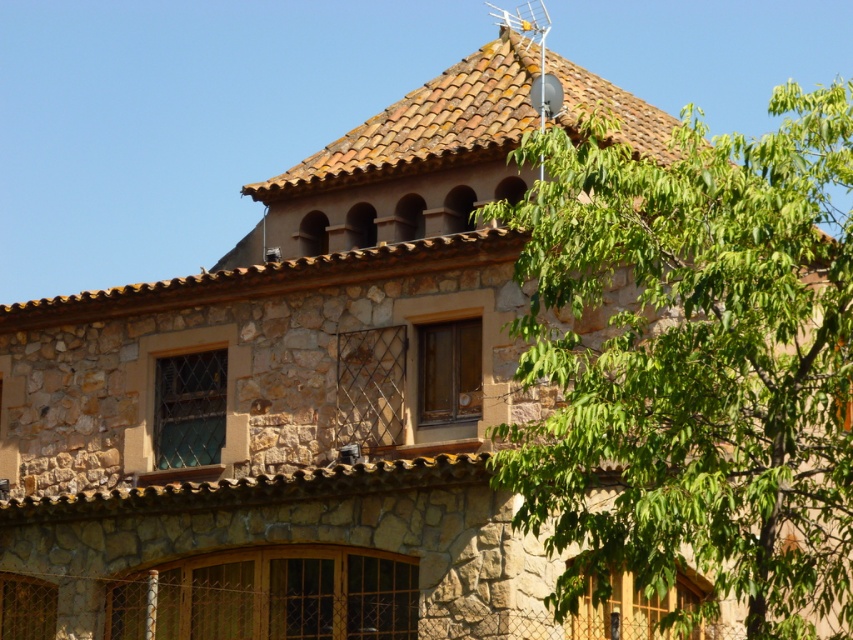
You are an architect assessing the structural integrity of the house. Given the presence of the green leafy tree at upper right and the brown clay tiles at upper center, which object might pose a greater risk to the roof due to its size and proximity?

The green leafy tree at upper right is bigger than the brown clay tiles at upper center, so the green leafy tree at upper right might pose a greater risk to the roof due to its larger size and proximity.

You are standing in front of the stone house and looking at two points on the roof. The first point is located at coordinates point (x=720, y=243) and the second at point (x=572, y=90). Which point is closer to your eyes?

Point (x=720, y=243) is closer to the camera than point (x=572, y=90), so the first point is closer to your eyes.

You are standing in front of the stone house and see a point marked at coordinates (694, 362). What object is located at that point?

The point at (694, 362) marks the green leafy tree at upper right.